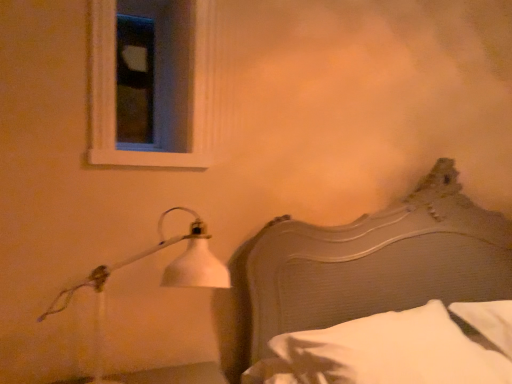
In order to face white wood frame at upper left, should I rotate leftwards or rightwards?

It's best to rotate left around 13.345 degrees.

Where is `white matte lamp at left`? This screenshot has height=384, width=512. white matte lamp at left is located at coordinates (161, 279).

Identify the location of white soft pillow at lower right. Image resolution: width=512 pixels, height=384 pixels. (386, 352).

Measure the distance between wooden headboard at right and camera.

wooden headboard at right is 4.77 feet away from camera.

Image resolution: width=512 pixels, height=384 pixels. Identify the location of white wood frame at upper left. (115, 93).

Based on the photo, from a real-world perspective, who is located higher, wooden headboard at right or white soft pillow at lower right?

In real-world perspective, wooden headboard at right is above.

From the picture: Is wooden headboard at right aimed at white soft pillow at lower right?

Yes.

How many degrees apart are the facing directions of wooden headboard at right and white soft pillow at lower right?

The angular difference between wooden headboard at right and white soft pillow at lower right is 0.00127 degrees.

Would you say wooden headboard at right is a long distance from white soft pillow at lower right?

No, there isn't a large distance between wooden headboard at right and white soft pillow at lower right.

How many degrees apart are the facing directions of white soft pillow at lower right and wooden headboard at right?

The angular difference between white soft pillow at lower right and wooden headboard at right is 0.00127 degrees.

From a real-world perspective, is white soft pillow at lower right physically located above or below wooden headboard at right?

white soft pillow at lower right is below wooden headboard at right.

Measure the distance from white soft pillow at lower right to wooden headboard at right.

They are 13.15 inches apart.

Considering their positions, is white soft pillow at lower right located in front of or behind wooden headboard at right?

white soft pillow at lower right is behind wooden headboard at right.

Considering their positions, is white wood frame at upper left located in front of or behind wooden headboard at right?

Clearly, white wood frame at upper left is behind wooden headboard at right.

From a real-world perspective, is white wood frame at upper left physically located above or below wooden headboard at right?

Clearly, from a real-world perspective, white wood frame at upper left is above wooden headboard at right.

From the image's perspective, relative to wooden headboard at right, is white wood frame at upper left above or below?

white wood frame at upper left is above wooden headboard at right.

Does white soft pillow at lower right contain white wood frame at upper left?

Definitely not — white wood frame at upper left is not inside white soft pillow at lower right.

Is white soft pillow at lower right touching white wood frame at upper left?

There is a gap between white soft pillow at lower right and white wood frame at upper left.

The width and height of the screenshot is (512, 384). Identify the location of window above the white soft pillow at lower right (from the image's perspective). (115, 93).

From a real-world perspective, is white soft pillow at lower right located higher than white wood frame at upper left?

No, from a real-world perspective, white soft pillow at lower right is not over white wood frame at upper left

Based on the photo, relative to white matte lamp at left, is wooden headboard at right in front or behind?

wooden headboard at right is in front of white matte lamp at left.

Does point (386, 280) appear closer or farther from the camera than point (91, 279)?

Point (386, 280) is positioned farther from the camera compared to point (91, 279).

Is wooden headboard at right spatially inside white matte lamp at left, or outside of it?

wooden headboard at right cannot be found inside white matte lamp at left.

Does wooden headboard at right appear on the left side of white matte lamp at left?

Incorrect, wooden headboard at right is not on the left side of white matte lamp at left.

Identify the location of pillow below the white wood frame at upper left (from a real-world perspective). The width and height of the screenshot is (512, 384). (386, 352).

Who is smaller, white wood frame at upper left or white soft pillow at lower right?

white wood frame at upper left.

Would you say white wood frame at upper left is a long distance from white soft pillow at lower right?

white wood frame at upper left is near white soft pillow at lower right, not far away.

Between point (176, 157) and point (465, 353), which one is positioned behind?

The point (176, 157) is behind.

In order to click on pillow below the white matte lamp at left (from a real-world perspective) in this screenshot , I will do `click(386, 352)`.

Is white matte lamp at left to the right of white soft pillow at lower right from the viewer's perspective?

Incorrect, white matte lamp at left is not on the right side of white soft pillow at lower right.

Is white matte lamp at left aimed at white soft pillow at lower right?

No.

From a real-world perspective, is white matte lamp at left physically located above or below white soft pillow at lower right?

white matte lamp at left is above white soft pillow at lower right.

Image resolution: width=512 pixels, height=384 pixels. Find the location of `pillow that appears below the wooden headboard at right (from the image's perspective)`. pillow that appears below the wooden headboard at right (from the image's perspective) is located at coordinates click(x=386, y=352).

Find the location of a particular element. pillow located on the left of wooden headboard at right is located at coordinates (x=386, y=352).

Considering their positions, is white matte lamp at left positioned further to white wood frame at upper left than wooden headboard at right?

Among the two, wooden headboard at right is located further to white wood frame at upper left.

Considering their positions, is white matte lamp at left positioned closer to white soft pillow at lower right than wooden headboard at right?

wooden headboard at right is closer to white soft pillow at lower right.

Estimate the real-world distances between objects in this image. Which object is further from wooden headboard at right, white wood frame at upper left or white matte lamp at left?

white wood frame at upper left is further to wooden headboard at right.

When comparing their distances from white wood frame at upper left, does white soft pillow at lower right or wooden headboard at right seem further?

The object further to white wood frame at upper left is white soft pillow at lower right.

From the image, which object appears to be nearer to white wood frame at upper left, white soft pillow at lower right or white matte lamp at left?

The object closer to white wood frame at upper left is white matte lamp at left.

Estimate the real-world distances between objects in this image. Which object is further from white matte lamp at left, white soft pillow at lower right or wooden headboard at right?

wooden headboard at right.

From the image, which object appears to be farther from white matte lamp at left, wooden headboard at right or white wood frame at upper left?

Among the two, wooden headboard at right is located further to white matte lamp at left.

Based on their spatial positions, is white wood frame at upper left or white soft pillow at lower right closer to wooden headboard at right?

Based on the image, white soft pillow at lower right appears to be nearer to wooden headboard at right.

Identify the location of pillow between white wood frame at upper left and wooden headboard at right. Image resolution: width=512 pixels, height=384 pixels. (386, 352).

I want to click on lamp between white wood frame at upper left and white soft pillow at lower right vertically, so click(x=161, y=279).

You are a GUI agent. You are given a task and a screenshot of the screen. Output one action in this format:
    pyautogui.click(x=<x>, y=<y>)
    Task: Click on the pillow situated between white matte lamp at left and wooden headboard at right from left to right
    This screenshot has width=512, height=384.
    Given the screenshot: What is the action you would take?
    pyautogui.click(x=386, y=352)

The height and width of the screenshot is (384, 512). I want to click on lamp between white wood frame at upper left and wooden headboard at right, so coord(161,279).